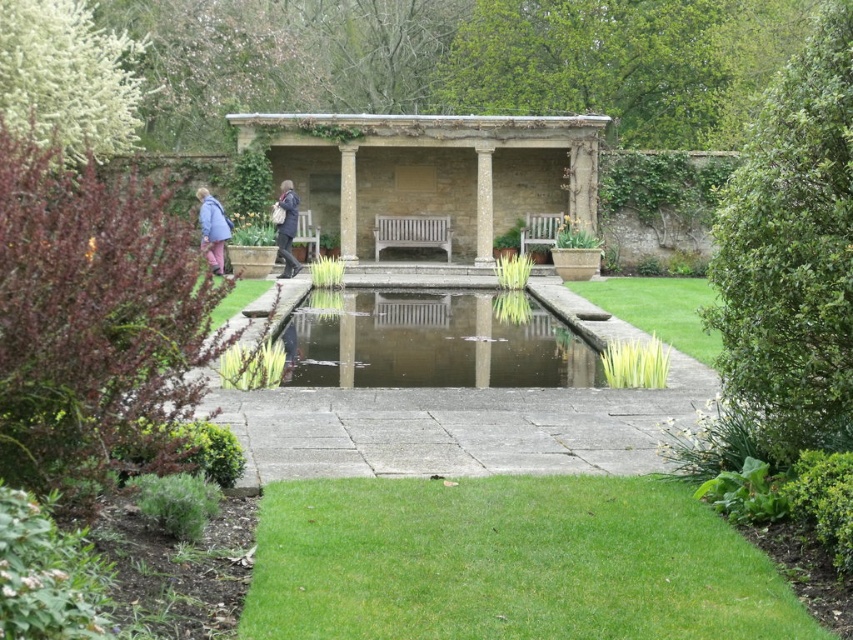
Question: Which point appears farthest from the camera in this image?

Choices:
 (A) (479, 225)
 (B) (206, 220)
 (C) (560, 180)
 (D) (347, 225)

Answer: (C)

Question: Is clear glass pond at center positioned in front of dark blue coat at center?

Choices:
 (A) yes
 (B) no

Answer: (A)

Question: Which object appears farthest from the camera in this image?

Choices:
 (A) dark blue coat at center
 (B) stone column at center

Answer: (B)

Question: Can you confirm if stone gazebo at center is positioned to the right of clear glass pond at center?

Choices:
 (A) yes
 (B) no

Answer: (B)

Question: Can you confirm if clear glass pond at center is positioned above white stone column at center?

Choices:
 (A) no
 (B) yes

Answer: (A)

Question: Which of these objects is positioned closest to the stone gazebo at center?

Choices:
 (A) stone column at center
 (B) blue fabric coat at left
 (C) white stone column at center

Answer: (C)